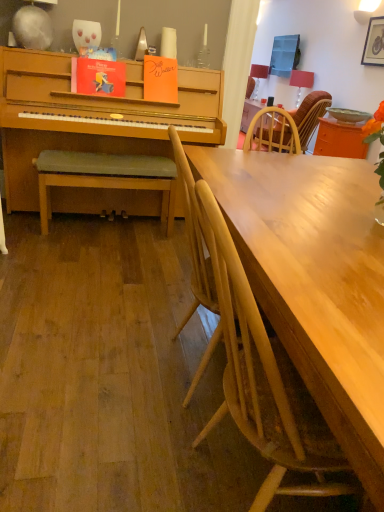
Question: Can you confirm if light wood chair at center, the 1th chair in the bottom-to-top sequence, is positioned to the right of green matte bowl at upper right?

Choices:
 (A) no
 (B) yes

Answer: (A)

Question: Considering the relative positions of light wood chair at center, positioned as the 2th chair in left-to-right order, and green matte bowl at upper right in the image provided, is light wood chair at center, positioned as the 2th chair in left-to-right order, behind green matte bowl at upper right?

Choices:
 (A) no
 (B) yes

Answer: (A)

Question: Is light wood chair at center, positioned as the 2th chair in left-to-right order, bigger than green matte bowl at upper right?

Choices:
 (A) yes
 (B) no

Answer: (A)

Question: Can you confirm if light wood chair at center, the 3th chair viewed from the top, is thinner than green matte bowl at upper right?

Choices:
 (A) no
 (B) yes

Answer: (A)

Question: Is light wood chair at center, which ranks as the second chair in right-to-left order, closer to the viewer compared to green matte bowl at upper right?

Choices:
 (A) yes
 (B) no

Answer: (A)

Question: Considering the relative positions of wooden textured chair at right, placed as the first chair when sorted from right to left, and orange glossy table at upper right in the image provided, is wooden textured chair at right, placed as the first chair when sorted from right to left, to the left or to the right of orange glossy table at upper right?

Choices:
 (A) left
 (B) right

Answer: (A)

Question: From a real-world perspective, is wooden textured chair at right, placed as the first chair when sorted from right to left, physically located above or below orange glossy table at upper right?

Choices:
 (A) above
 (B) below

Answer: (A)

Question: In terms of height, does wooden textured chair at right, arranged as the 1th chair when viewed from the top, look taller or shorter compared to orange glossy table at upper right?

Choices:
 (A) tall
 (B) short

Answer: (A)

Question: Is wooden textured chair at right, the 3th chair when ordered from front to back, inside or outside of orange glossy table at upper right?

Choices:
 (A) inside
 (B) outside

Answer: (B)

Question: Would you say wooden picture frame at upper right is inside or outside wooden textured chair at right, the 3th chair when ordered from front to back?

Choices:
 (A) outside
 (B) inside

Answer: (A)

Question: From the image's perspective, is wooden picture frame at upper right located above or below wooden textured chair at right, placed as the first chair when sorted from right to left?

Choices:
 (A) below
 (B) above

Answer: (B)

Question: Visually, is wooden picture frame at upper right positioned to the left or to the right of wooden textured chair at right, placed as the 3th chair when sorted from left to right?

Choices:
 (A) left
 (B) right

Answer: (B)

Question: In terms of size, does wooden picture frame at upper right appear bigger or smaller than wooden textured chair at right, the 3th chair when ordered from front to back?

Choices:
 (A) big
 (B) small

Answer: (B)

Question: Is matte red lampshade at upper right, acting as the first lamp starting from the back, in front of or behind orange glossy table at upper right in the image?

Choices:
 (A) behind
 (B) front

Answer: (A)

Question: In the image, is matte red lampshade at upper right, which ranks as the 1th lamp in top-to-bottom order, on the left side or the right side of orange glossy table at upper right?

Choices:
 (A) left
 (B) right

Answer: (A)